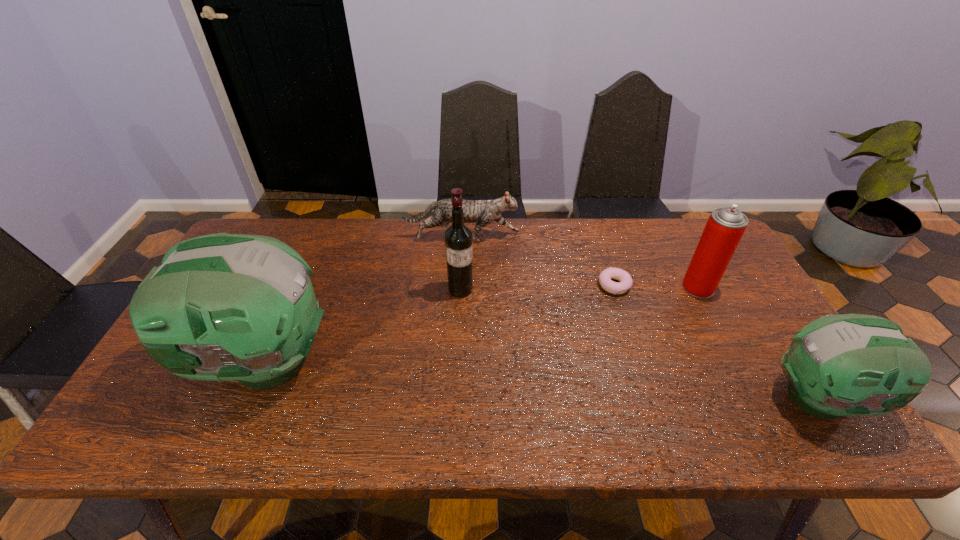
Locate an element on the screen. This screenshot has height=540, width=960. free spot that satisfies the following two spatial constraints: 1. on the front side of the shortest object; 2. on the visor of the left football helmet is located at coordinates (638, 361).